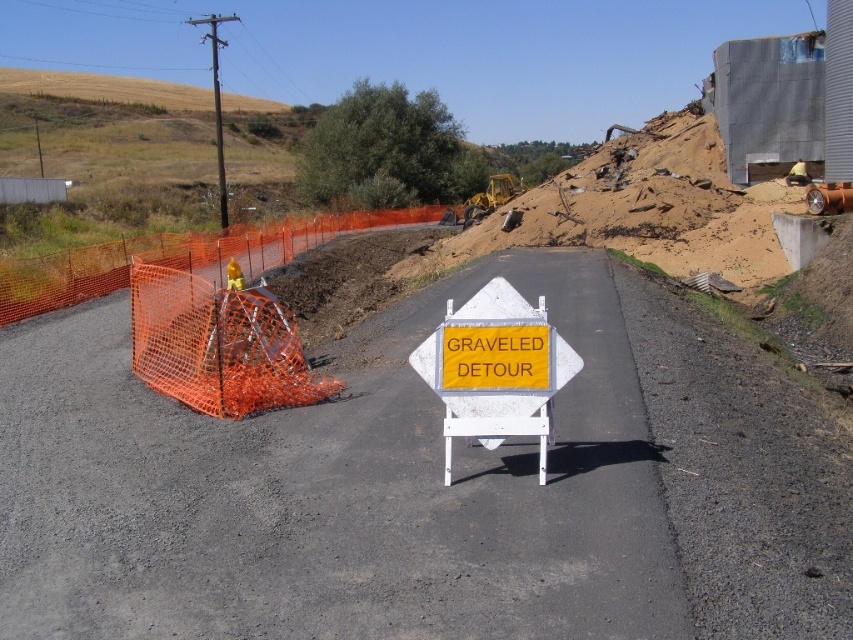
Is orange mesh barricade at left positioned in front of orange mesh fence at left?

Yes, orange mesh barricade at left is in front of orange mesh fence at left.

Where is `orange mesh barricade at left`? This screenshot has height=640, width=853. orange mesh barricade at left is located at coordinates (218, 344).

At what (x,y) coordinates should I click in order to perform the action: click on orange mesh barricade at left. Please return your answer as a coordinate pair (x, y). This screenshot has height=640, width=853. Looking at the image, I should click on (218, 344).

Does yellow reflective plastic sign at center have a greater width compared to orange mesh fence at left?

No, yellow reflective plastic sign at center is not wider than orange mesh fence at left.

Between yellow reflective plastic sign at center and orange mesh fence at left, which one has less height?

With less height is yellow reflective plastic sign at center.

Find the location of a particular element. The image size is (853, 640). yellow reflective plastic sign at center is located at coordinates (496, 369).

Is orange mesh barricade at left closer to the viewer compared to yellow reflective plastic sign at center?

That is False.

Who is more distant from viewer, (177, 280) or (471, 301)?

Positioned behind is point (177, 280).

Image resolution: width=853 pixels, height=640 pixels. What do you see at coordinates (218, 344) in the screenshot? I see `orange mesh barricade at left` at bounding box center [218, 344].

Locate an element on the screen. This screenshot has width=853, height=640. orange mesh barricade at left is located at coordinates (218, 344).